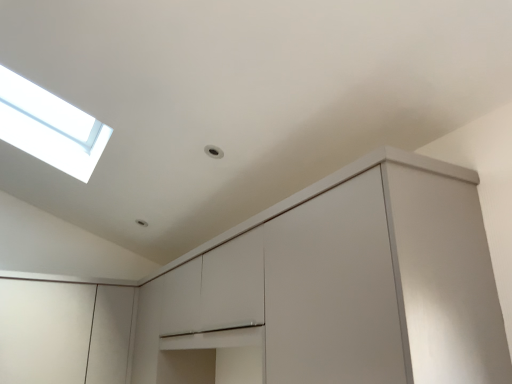
Question: In the image, is matte white cabinet at center, which appears as the second cabinetry when viewed from the left, on the left side or the right side of white matte cabinet at lower left, the second cabinetry positioned from the right?

Choices:
 (A) right
 (B) left

Answer: (A)

Question: Looking at their shapes, would you say matte white cabinet at center, which is the 1th cabinetry in right-to-left order, is wider or thinner than white matte cabinet at lower left, the second cabinetry positioned from the right?

Choices:
 (A) thin
 (B) wide

Answer: (A)

Question: From their relative heights in the image, would you say matte white cabinet at center, which is the 1th cabinetry in right-to-left order, is taller or shorter than white matte cabinet at lower left, which is the first cabinetry from left to right?

Choices:
 (A) short
 (B) tall

Answer: (B)

Question: Is white matte cabinet at lower left, which is the first cabinetry from left to right, situated inside matte white cabinet at center, which is the 1th cabinetry in right-to-left order, or outside?

Choices:
 (A) inside
 (B) outside

Answer: (B)

Question: Does point (58, 314) appear closer or farther from the camera than point (332, 377)?

Choices:
 (A) farther
 (B) closer

Answer: (A)

Question: From the image's perspective, is white matte cabinet at lower left, which is the first cabinetry from left to right, positioned above or below matte white cabinet at center, which is the 1th cabinetry in right-to-left order?

Choices:
 (A) above
 (B) below

Answer: (B)

Question: In terms of width, does white matte cabinet at lower left, the second cabinetry positioned from the right, look wider or thinner when compared to matte white cabinet at center, which appears as the second cabinetry when viewed from the left?

Choices:
 (A) wide
 (B) thin

Answer: (A)